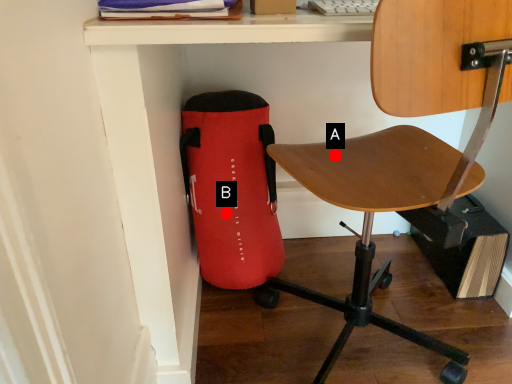
Question: Two points are circled on the image, labeled by A and B beside each circle. Which point is closer to the camera?

Choices:
 (A) A is closer
 (B) B is closer

Answer: (A)